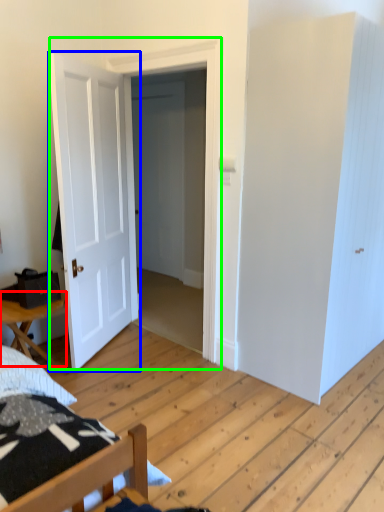
Question: Considering the real-world distances, which object is farthest from table (highlighted by a red box)? door (highlighted by a blue box) or door (highlighted by a green box)?

Choices:
 (A) door
 (B) door

Answer: (B)